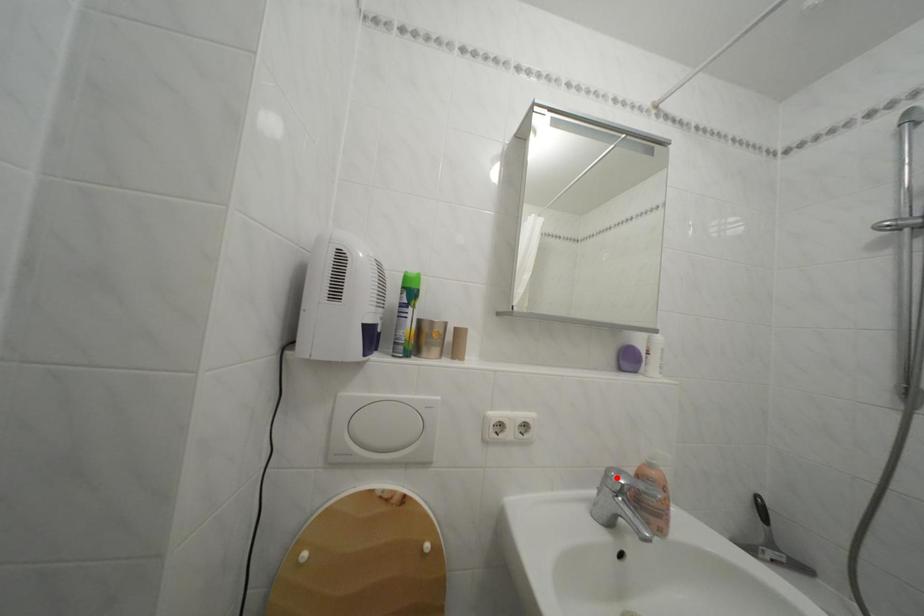
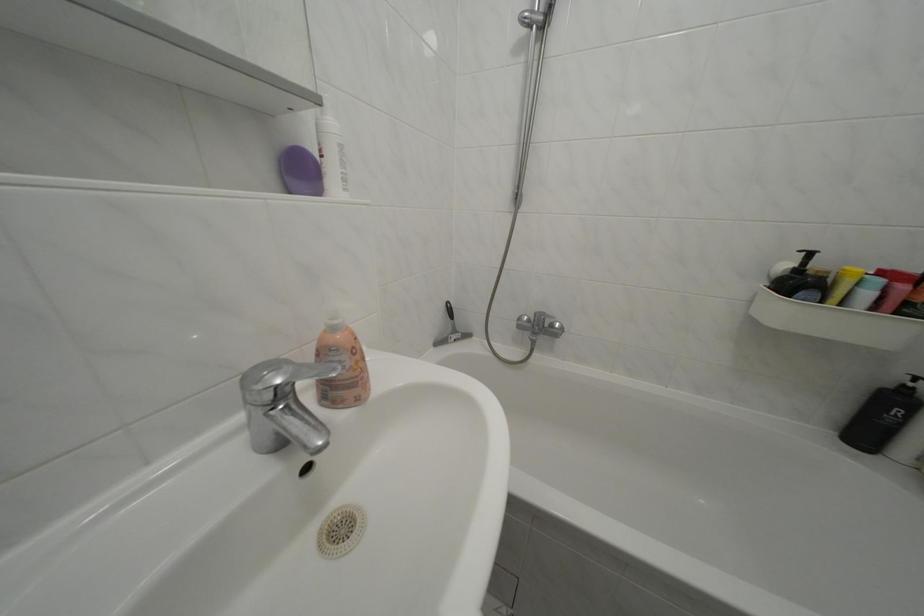
Where in the second image is the point corresponding to the highlighted location from the first image?

(252, 384)